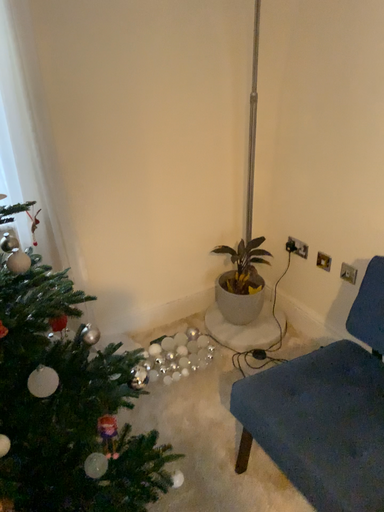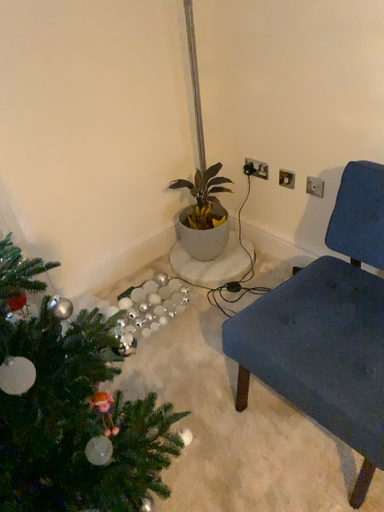
Question: How did the camera likely rotate when shooting the video?

Choices:
 (A) rotated upward
 (B) rotated downward

Answer: (B)